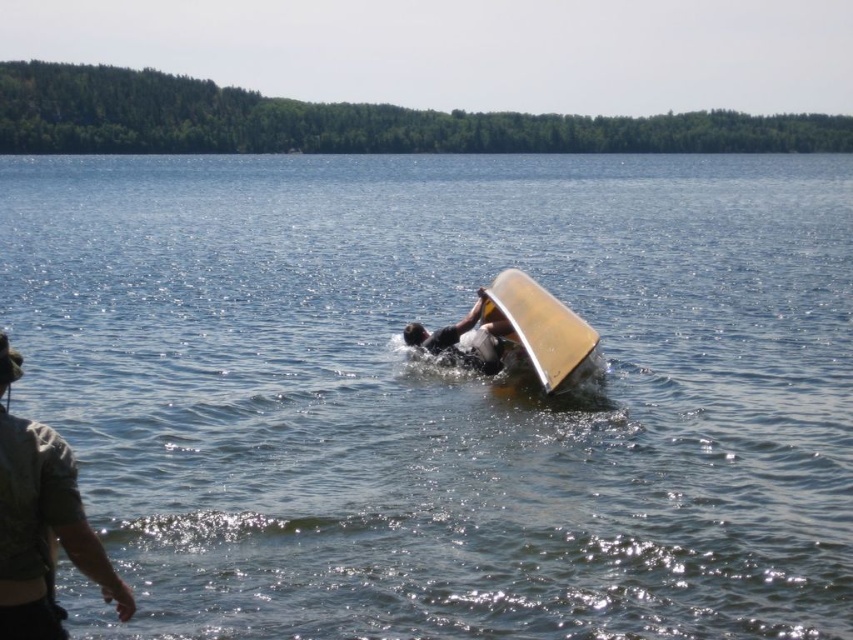
You are a photographer standing at the shore of the lake. You want to take a closeup shot of the transparent plastic surfboard at center. Based on the scene, can you determine if the surfboard is within your camera lens range of 50 feet?

The transparent plastic surfboard at center is 65.02 feet away from the camera, which is beyond the 50 feet lens range. Therefore, the surfboard is out of the camera lens range.

You are a photographer positioned at the center of the image. You want to capture a closeup of the camouflage fabric shirt at left without moving your camera. Can you do it based on its current position?

The camouflage fabric shirt at left is located at point (44, 531), which is within the frame of the image, so yes, you can capture a closeup of the camouflage fabric shirt at left without moving your camera.